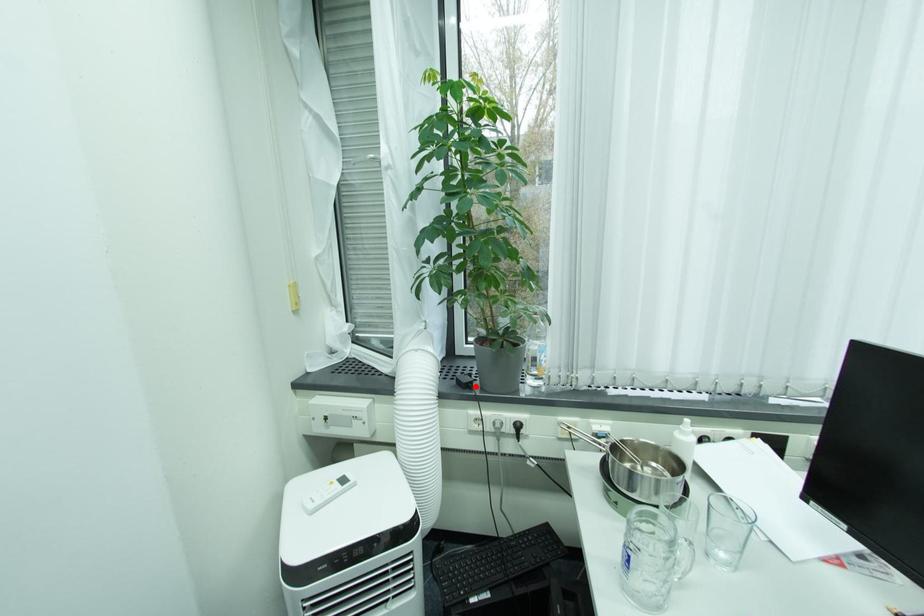
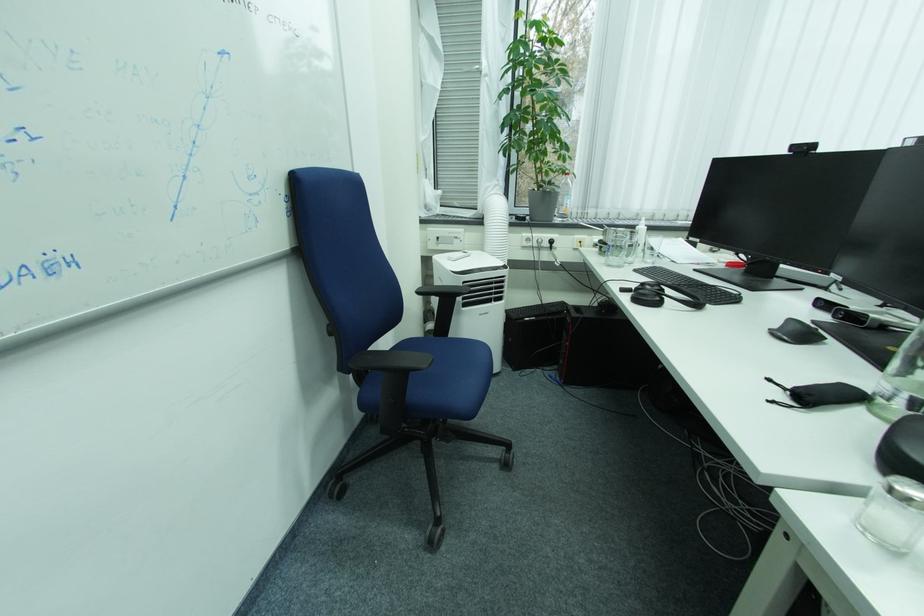
Locate, in the second image, the point that corresponds to the highlighted location in the first image.

(530, 220)